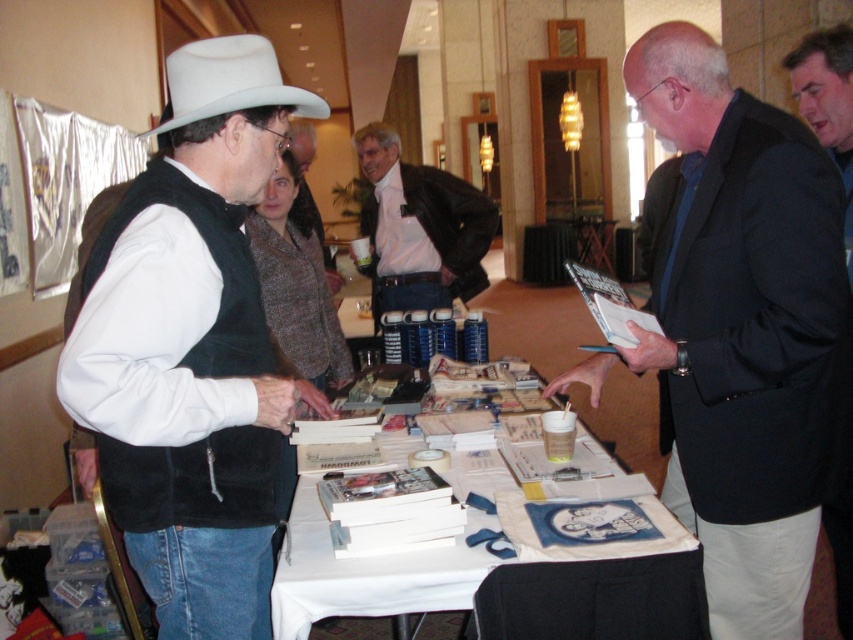
Is black suit at center bigger than white felt cowboy hat at upper left?

Indeed, black suit at center has a larger size compared to white felt cowboy hat at upper left.

Who is higher up, black suit at center or white felt cowboy hat at upper left?

Positioned higher is black suit at center.

What do you see at coordinates (827, 104) in the screenshot? This screenshot has width=853, height=640. I see `black suit at center` at bounding box center [827, 104].

You are a GUI agent. You are given a task and a screenshot of the screen. Output one action in this format:
    pyautogui.click(x=<x>, y=<y>)
    Task: Click on the black suit at center
    This screenshot has height=640, width=853.
    Given the screenshot: What is the action you would take?
    pyautogui.click(x=827, y=104)

Is dark blue suit jacket at center below black suit at center?

Indeed, dark blue suit jacket at center is positioned under black suit at center.

Describe the element at coordinates (741, 326) in the screenshot. I see `dark blue suit jacket at center` at that location.

Find the location of a particular element. Image resolution: width=853 pixels, height=640 pixels. dark blue suit jacket at center is located at coordinates (741, 326).

Locate an element on the screen. pink shirt at center is located at coordinates (421, 228).

In the scene shown: Which is above, pink shirt at center or white felt cowboy hat at upper left?

pink shirt at center is higher up.

Is point (373, 124) farther from camera compared to point (248, 74)?

Yes, it is.

In order to click on pink shirt at center in this screenshot , I will do `click(421, 228)`.